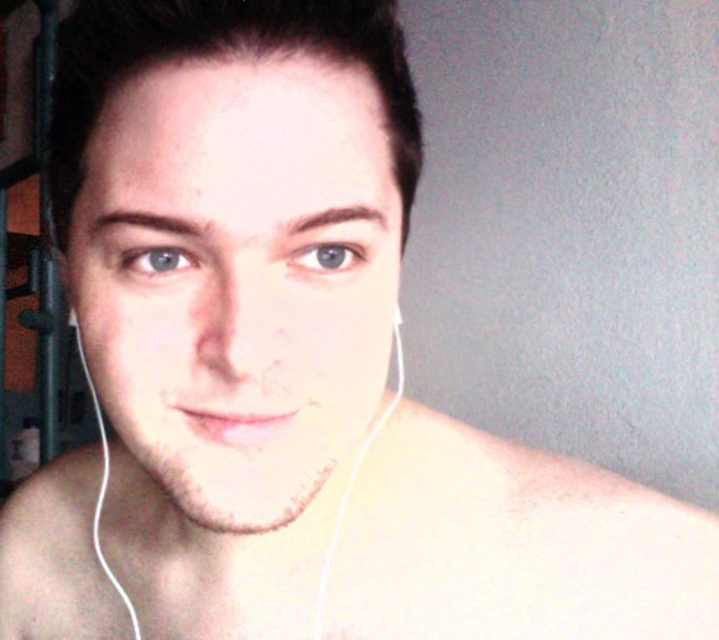
Question: Is smooth skin earphones at center smaller than white earphone at left?

Choices:
 (A) no
 (B) yes

Answer: (A)

Question: Which of the following is the closest to the observer?

Choices:
 (A) smooth skin earphones at center
 (B) white earphone at left

Answer: (B)

Question: Which point is farther to the camera?

Choices:
 (A) (319, 627)
 (B) (400, 316)

Answer: (B)

Question: Is the position of smooth skin earphones at center more distant than that of white earphone at left?

Choices:
 (A) yes
 (B) no

Answer: (A)

Question: Is smooth skin earphones at center below white earphone at left?

Choices:
 (A) yes
 (B) no

Answer: (A)